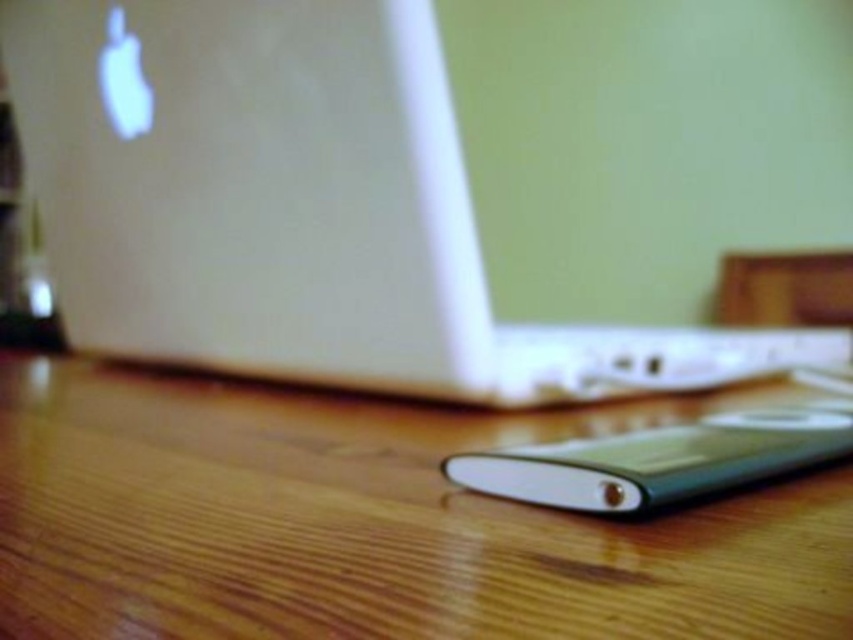
You are organizing items on the wooden table at lower center and notice the white glossy laptop at center. Since the laptop is above the table, where exactly should you place it to ensure it stays on the table?

The white glossy laptop at center is already located above the wooden table at lower center, so it is positioned on top of the table. To ensure it stays there, place it carefully on the table surface without tilting it off the edges.